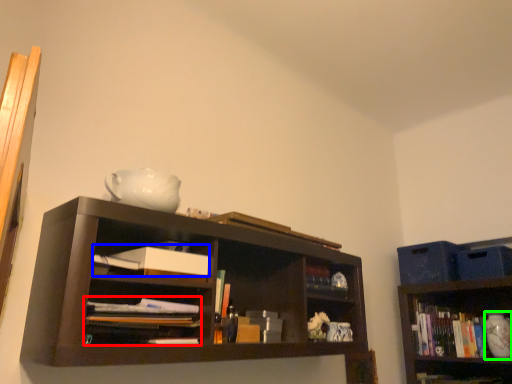
Question: Which object is the farthest from book (highlighted by a red box)? Choose among these: paperback book (highlighted by a blue box) or glass vase (highlighted by a green box).

Choices:
 (A) paperback book
 (B) glass vase

Answer: (B)